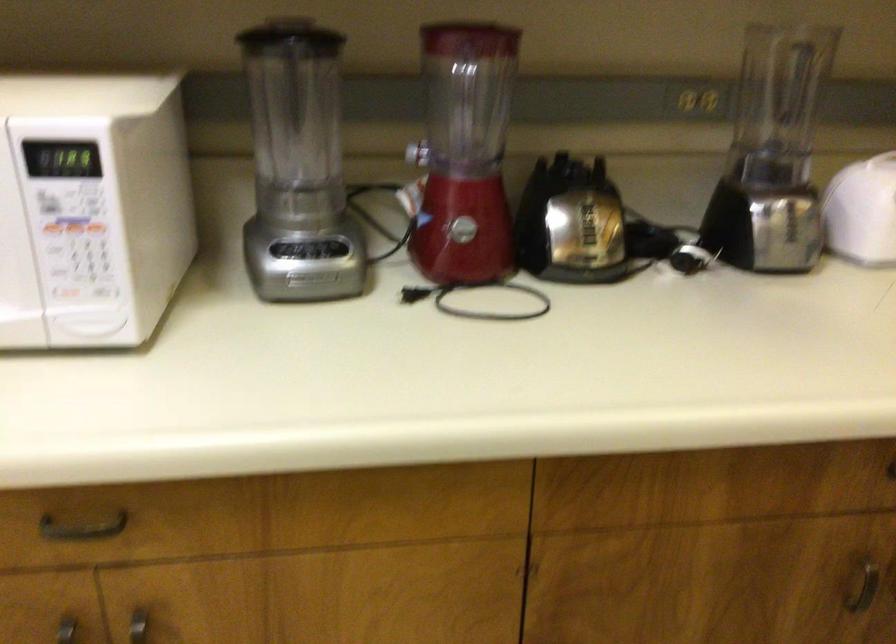
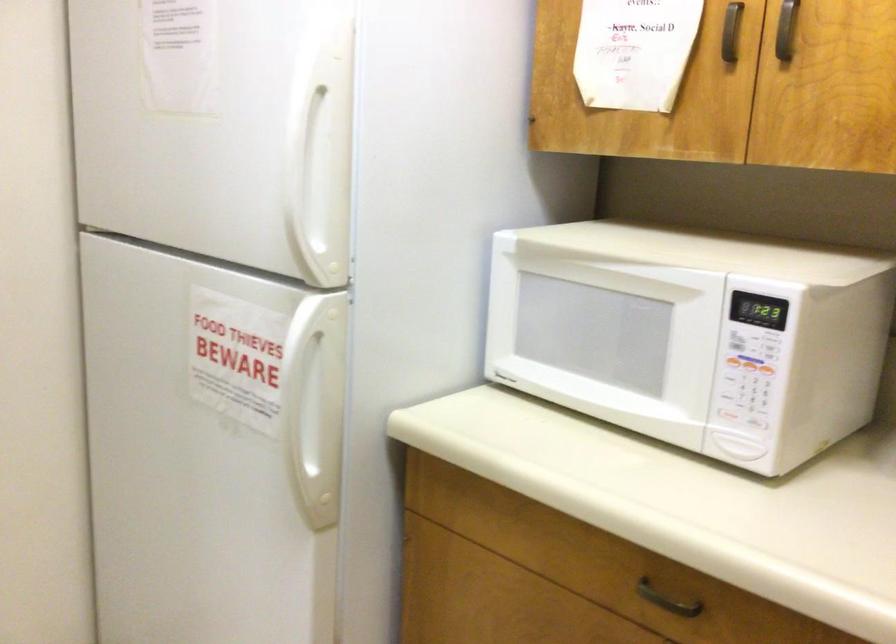
Question: The images are taken continuously from a first-person perspective. In which direction is your viewpoint rotating?

Choices:
 (A) Left
 (B) Right
 (C) Up
 (D) Down

Answer: (A)